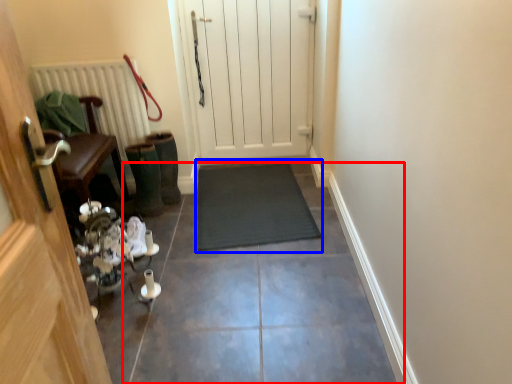
Question: Which of the following is the farthest to the observer, path (highlighted by a red box) or doormat (highlighted by a blue box)?

Choices:
 (A) path
 (B) doormat

Answer: (B)